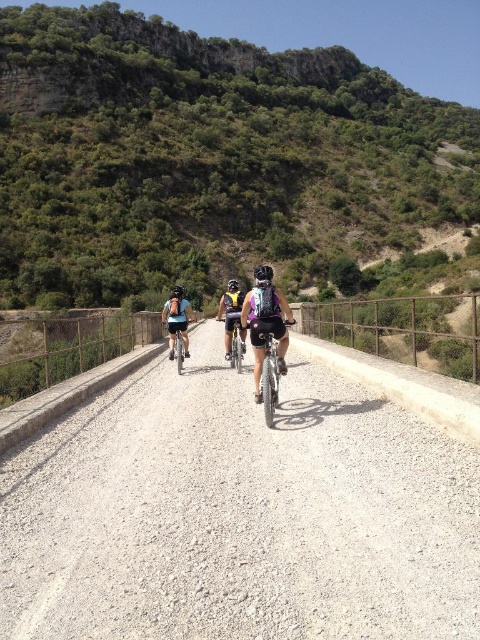
Does metallic silver bicycle at center appear on the left side of shiny silver bicycle at center?

Incorrect, metallic silver bicycle at center is not on the left side of shiny silver bicycle at center.

Who is positioned more to the left, metallic silver bicycle at center or shiny silver bicycle at center?

shiny silver bicycle at center is more to the left.

Where is `metallic silver bicycle at center`? metallic silver bicycle at center is located at coordinates (267, 371).

How much distance is there between matte purple bicycle at center and black matte bicycle helmet at center?

A distance of 4.88 meters exists between matte purple bicycle at center and black matte bicycle helmet at center.

Who is lower down, matte purple bicycle at center or black matte bicycle helmet at center?

matte purple bicycle at center is lower down.

From the picture: Who is more forward, (240,356) or (266,272)?

Positioned in front is point (266,272).

Where is `matte purple bicycle at center`? The image size is (480, 640). matte purple bicycle at center is located at coordinates (235, 340).

The height and width of the screenshot is (640, 480). What are the coordinates of `matte purple backpack at center` in the screenshot? It's located at (265, 326).

Can you confirm if matte purple backpack at center is bigger than matte purple bicycle at center?

Indeed, matte purple backpack at center has a larger size compared to matte purple bicycle at center.

In order to click on matte purple backpack at center in this screenshot , I will do `click(265, 326)`.